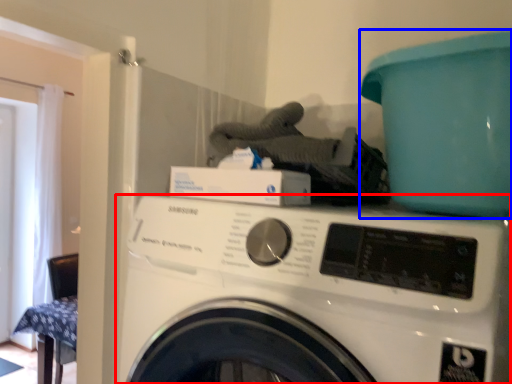
Question: Among these objects, which one is nearest to the camera, washing machine (highlighted by a red box) or teal (highlighted by a blue box)?

Choices:
 (A) washing machine
 (B) teal

Answer: (A)